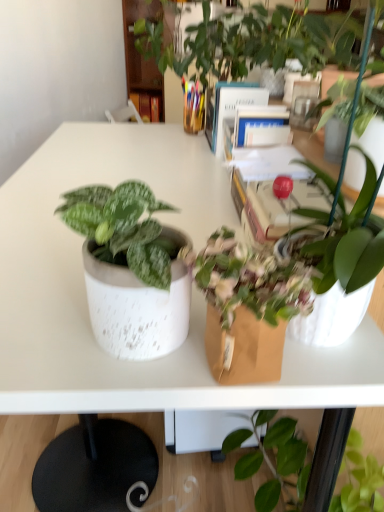
Question: Is hardcover book at center, the third book viewed from the right, aimed at hardcover book at center, marked as the 3th book in a top-to-bottom arrangement?

Choices:
 (A) no
 (B) yes

Answer: (A)

Question: Would you say hardcover book at center, the 3th book positioned from the left, is part of hardcover book at center, which is counted as the 3th book, starting from the front,'s contents?

Choices:
 (A) no
 (B) yes

Answer: (A)

Question: Considering the relative sizes of hardcover book at center, marked as the first book in a top-to-bottom arrangement, and hardcover book at center, the first book when ordered from bottom to top, in the image provided, is hardcover book at center, marked as the first book in a top-to-bottom arrangement, smaller than hardcover book at center, the first book when ordered from bottom to top,?

Choices:
 (A) yes
 (B) no

Answer: (A)

Question: From a real-world perspective, is hardcover book at center, the first book viewed from the back, over hardcover book at center, marked as the 3th book in a top-to-bottom arrangement?

Choices:
 (A) yes
 (B) no

Answer: (B)

Question: Considering the relative sizes of hardcover book at center, marked as the first book in a top-to-bottom arrangement, and hardcover book at center, the third book positioned from the back, in the image provided, is hardcover book at center, marked as the first book in a top-to-bottom arrangement, thinner than hardcover book at center, the third book positioned from the back,?

Choices:
 (A) no
 (B) yes

Answer: (B)

Question: Based on their sizes in the image, would you say hardcover book at center, the 3th book positioned from the left, is bigger or smaller than hardcover book at center, which is counted as the 3th book, starting from the front?

Choices:
 (A) big
 (B) small

Answer: (A)

Question: Is point (278, 110) closer or farther from the camera than point (152, 120)?

Choices:
 (A) closer
 (B) farther

Answer: (A)

Question: Is hardcover book at center, the third book positioned from the back, inside the boundaries of hardcover book at center, acting as the 3th book starting from the bottom, or outside?

Choices:
 (A) inside
 (B) outside

Answer: (B)

Question: From the image's perspective, is hardcover book at center, the first book when ordered from bottom to top, located above or below hardcover book at center, the third book viewed from the right?

Choices:
 (A) below
 (B) above

Answer: (A)

Question: From the image's perspective, relative to hardcover book at center, the third book viewed from the right, is blue hardcover book at upper center, the second book when ordered from front to back, above or below?

Choices:
 (A) below
 (B) above

Answer: (A)

Question: In terms of width, does blue hardcover book at upper center, marked as the 2th book in a left-to-right arrangement, look wider or thinner when compared to hardcover book at center, the third book viewed from the right?

Choices:
 (A) wide
 (B) thin

Answer: (A)

Question: Based on their sizes in the image, would you say blue hardcover book at upper center, the second book when ordered from front to back, is bigger or smaller than hardcover book at center, which is counted as the 3th book, starting from the front?

Choices:
 (A) big
 (B) small

Answer: (A)

Question: Is point (251, 97) closer or farther from the camera than point (160, 116)?

Choices:
 (A) closer
 (B) farther

Answer: (A)

Question: In terms of height, does blue hardcover book at upper center, marked as the 2th book in a left-to-right arrangement, look taller or shorter compared to hardcover book at center, the first book when ordered from bottom to top?

Choices:
 (A) short
 (B) tall

Answer: (B)

Question: In terms of width, does blue hardcover book at upper center, the second book when ordered from front to back, look wider or thinner when compared to hardcover book at center, the first book positioned from the front?

Choices:
 (A) wide
 (B) thin

Answer: (A)